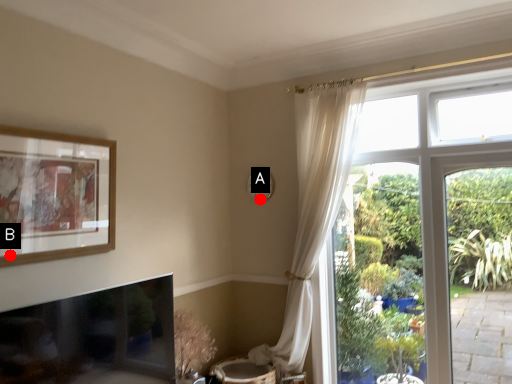
Question: Two points are circled on the image, labeled by A and B beside each circle. Which of the following is the farthest from the observer?

Choices:
 (A) A is further
 (B) B is further

Answer: (A)